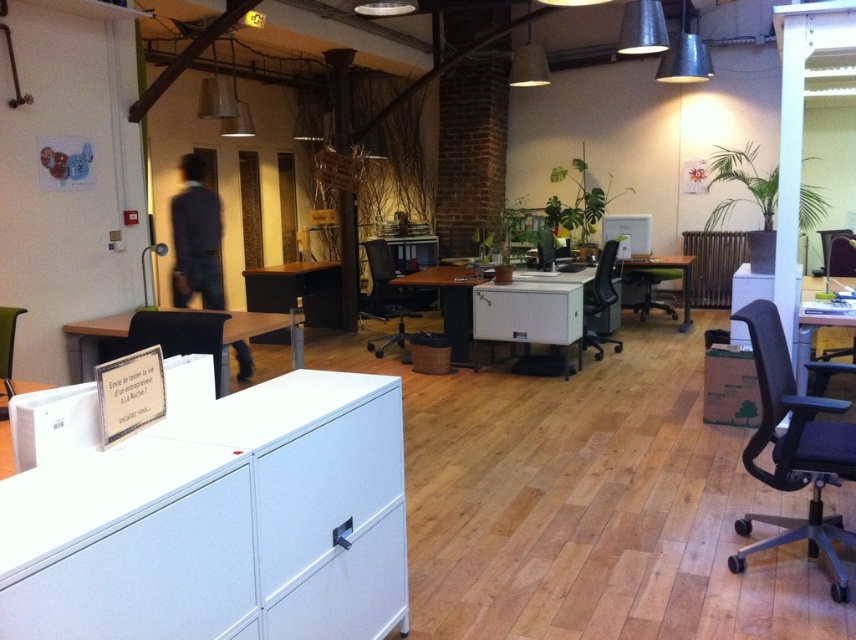
Consider the image. You are standing in the office and want to reach the point at coordinates point (263, 554). If your walking speed is 1.5 meters per second, how long will it take you to reach that point?

The distance between you and the point (263, 554) is 1.81 meters. At a speed of 1.5 meters per second, it will take approximately 1.21 seconds to reach the point.

You are an office worker who needs to place a new plant on the desk that is higher up. Which desk should you choose between the white glossy table at right and the green matte desk at center?

The green matte desk at center is higher up, so you should choose the green matte desk at center to place the new plant.

You are an office worker who needs to access both the white matte file cabinet at lower left and the white glossy table at right. From your current position, which one is closer to you?

The white matte file cabinet at lower left is closer to you because it is positioned in front of the white glossy table at right.